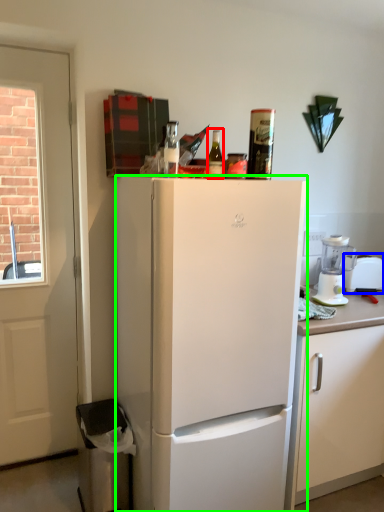
Question: Considering the real-world distances, which object is closest to bottle (highlighted by a red box)? appliance (highlighted by a blue box) or refrigerator (highlighted by a green box).

Choices:
 (A) appliance
 (B) refrigerator

Answer: (B)